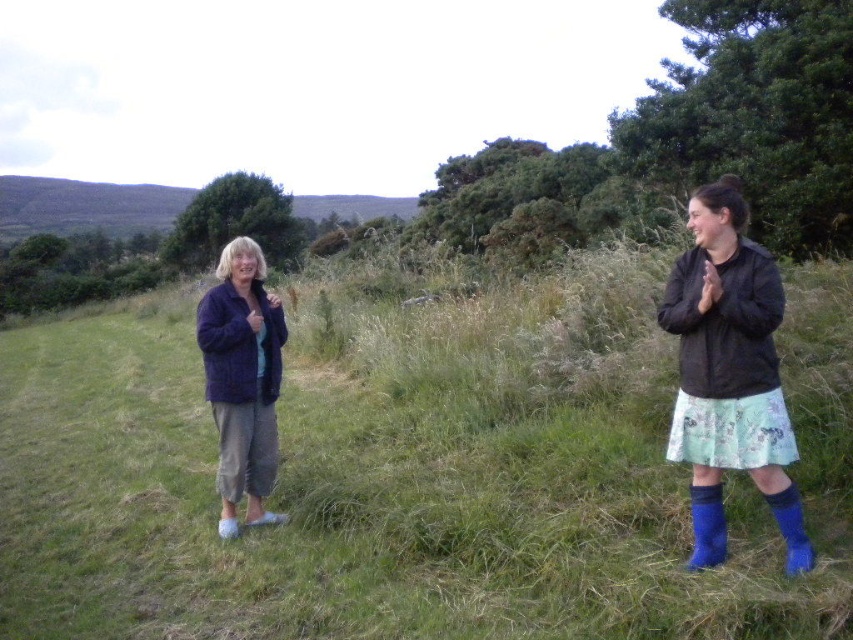
Question: Is green grassy at center to the right of dark blue fleece jacket at left from the viewer's perspective?

Choices:
 (A) yes
 (B) no

Answer: (A)

Question: Can you confirm if green grassy at center is positioned to the left of floral skirt at right?

Choices:
 (A) no
 (B) yes

Answer: (B)

Question: Which point appears farthest from the camera in this image?

Choices:
 (A) (566, 602)
 (B) (699, 464)

Answer: (B)

Question: Among these objects, which one is farthest from the camera?

Choices:
 (A) green grassy at center
 (B) floral skirt at right

Answer: (B)

Question: Does green grassy at center appear on the left side of dark blue fleece jacket at left?

Choices:
 (A) yes
 (B) no

Answer: (B)

Question: Estimate the real-world distances between objects in this image. Which object is closer to the green grassy at center?

Choices:
 (A) dark blue fleece jacket at left
 (B) floral skirt at right

Answer: (B)